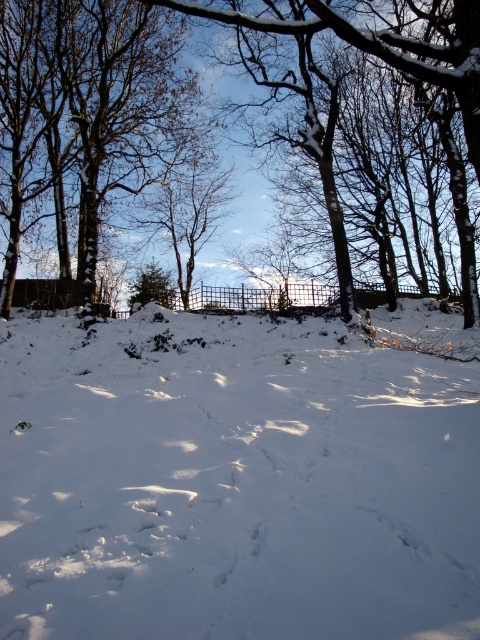
Who is higher up, white powdery snow at lower center or smooth bark tree at upper left?

smooth bark tree at upper left is above.

Is point (425, 545) positioned before point (81, 60)?

Yes, point (425, 545) is in front of point (81, 60).

The height and width of the screenshot is (640, 480). Find the location of `white powdery snow at lower center`. white powdery snow at lower center is located at coordinates (233, 483).

Is smooth bark tree at upper left wider than snow-covered tree at center?

In fact, smooth bark tree at upper left might be narrower than snow-covered tree at center.

Which is in front, point (131, 72) or point (82, 257)?

Positioned in front is point (131, 72).

Where is `smooth bark tree at upper left`? smooth bark tree at upper left is located at coordinates (118, 104).

Based on the photo, who is taller, white powdery snow at lower center or snow-covered tree at center?

Standing taller between the two is snow-covered tree at center.

Does white powdery snow at lower center have a lesser height compared to snow-covered tree at center?

Yes.

Locate an element on the screen. This screenshot has width=480, height=640. white powdery snow at lower center is located at coordinates (233, 483).

At what (x,y) coordinates should I click in order to perform the action: click on white powdery snow at lower center. Please return your answer as a coordinate pair (x, y). This screenshot has height=640, width=480. Looking at the image, I should click on (233, 483).